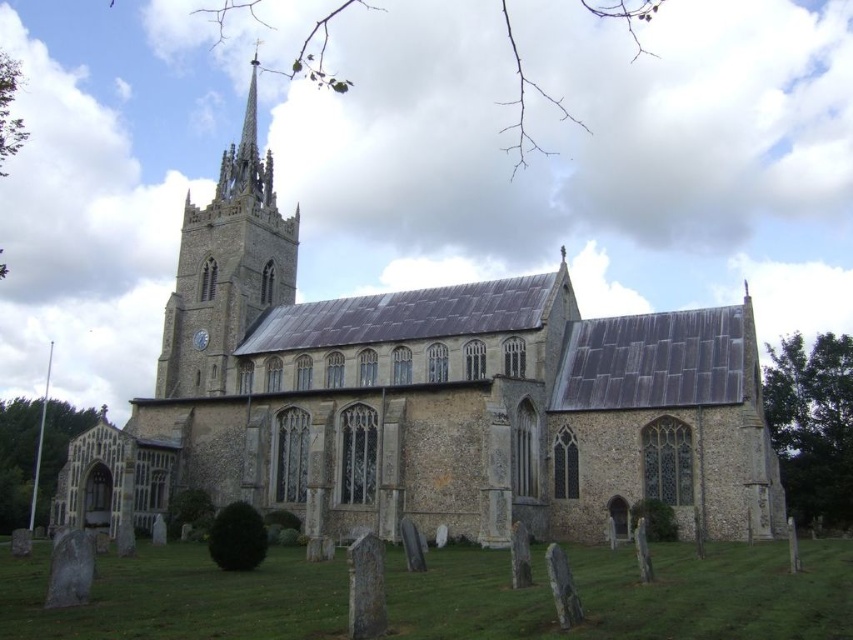
You are standing at the entrance of the stone church at center and looking towards the dark gray stone gravestone at lower center. Which object is taller?

The stone church at center is taller than the dark gray stone gravestone at lower center according to the description.

Looking at this image, you are a tourist visiting the historic site and want to take a photo that includes both the stone church at center and the dark gray stone gravestone at lower center. Given their sizes, which object should you position closer to the camera to ensure both are visible in the frame?

Since the stone church at center is larger than the dark gray stone gravestone at lower center, you should position the dark gray stone gravestone at lower center closer to the camera to balance their sizes in the photo.

You are standing at the entrance of the historic stone church and notice two gray stone gravestones. The first is the dark gray stone gravestone at lower center and the second is the gray stone gravestone at lower left. Which of these two gravestones is positioned higher up in the image?

The dark gray stone gravestone at lower center is positioned higher up in the image as it is above the gray stone gravestone at lower left.